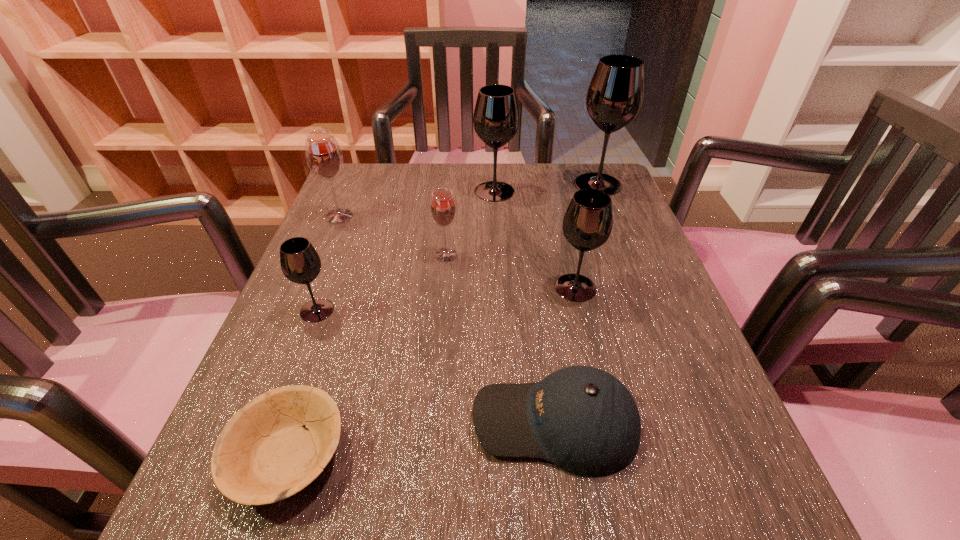
Where is `vacant space that is in between the bowl and the blue baseball cap`? vacant space that is in between the bowl and the blue baseball cap is located at coordinates (422, 439).

This screenshot has height=540, width=960. I want to click on vacant space that is in between the second tallest object and the second shortest object, so click(525, 307).

Identify the location of vacant point located between the third gray wineglass from left to right and the third smallest gray wineglass. (535, 239).

Identify which object is the closest to the seventh tallest object. Please provide its 2D coordinates. Your answer should be formatted as a tuple, i.e. [(x, y)], where the tuple contains the x and y coordinates of a point satisfying the conditions above.

[(587, 224)]

Identify the location of object that stands as the fourth closest to the smallest gray wineglass. (584, 420).

Select which wineglass is the second closest to the bowl. Please provide its 2D coordinates. Your answer should be formatted as a tuple, i.e. [(x, y)], where the tuple contains the x and y coordinates of a point satisfying the conditions above.

[(443, 209)]

This screenshot has height=540, width=960. Find the location of `the second closest wineglass to the third farthest object`. the second closest wineglass to the third farthest object is located at coordinates (300, 262).

You are a GUI agent. You are given a task and a screenshot of the screen. Output one action in this format:
    pyautogui.click(x=<x>, y=<y>)
    Task: Click on the gray wineglass that is the closest to the second biggest gray wineglass
    
    Given the screenshot: What is the action you would take?
    pyautogui.click(x=615, y=95)

Locate which gray wineglass is the closest to the third gray wineglass from left to right. Please provide its 2D coordinates. Your answer should be formatted as a tuple, i.e. [(x, y)], where the tuple contains the x and y coordinates of a point satisfying the conditions above.

[(496, 116)]

At what (x,y) coordinates should I click in order to perform the action: click on free space that satisfies the following two spatial constraints: 1. on the back side of the biggest gray wineglass; 2. on the right side of the shortest object. Please return your answer as a coordinate pair (x, y). Looking at the image, I should click on (379, 184).